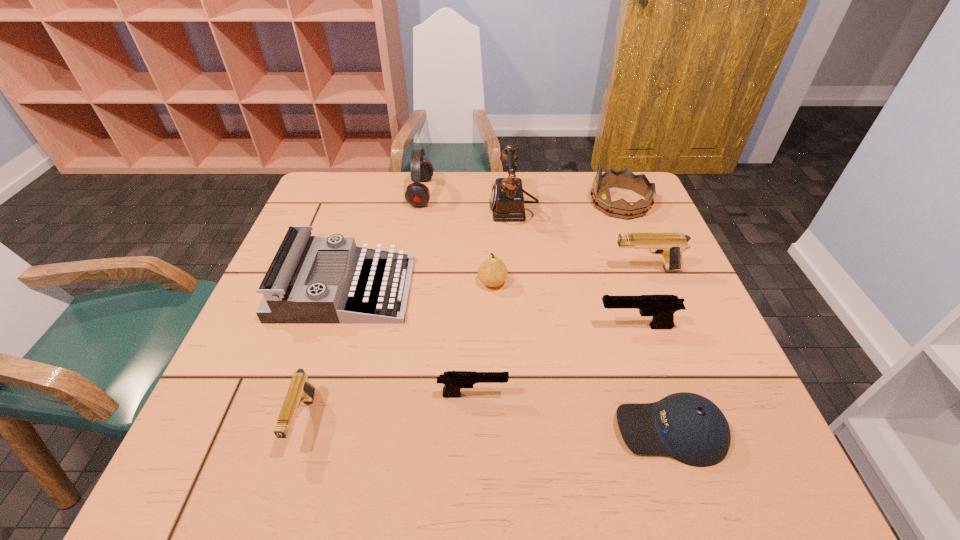
You are a GUI agent. You are given a task and a screenshot of the screen. Output one action in this format:
    pyautogui.click(x=<x>, y=<y>)
    Task: Click on the vacant point located at the front of the tiara with jewels
    The image size is (960, 540).
    Given the screenshot: What is the action you would take?
    pyautogui.click(x=557, y=202)

Locate an element on the screen. This screenshot has width=960, height=540. vacant space situated 0.230m at the barrel of the farthest pistol is located at coordinates (520, 269).

Find the location of a particular element. This screenshot has height=540, width=960. free space located 0.090m at the barrel of the farthest pistol is located at coordinates (575, 269).

The width and height of the screenshot is (960, 540). Find the location of `vacant space located at the barrel of the farthest pistol`. vacant space located at the barrel of the farthest pistol is located at coordinates (469, 269).

You are a GUI agent. You are given a task and a screenshot of the screen. Output one action in this format:
    pyautogui.click(x=<x>, y=<y>)
    Task: Click on the vacant space situated on the typing side of the black typewriter
    
    Given the screenshot: What is the action you would take?
    pyautogui.click(x=541, y=289)

Identify the location of vacant area situated 0.110m on the front-facing side of the right black pistol. Image resolution: width=960 pixels, height=540 pixels. (547, 326).

The height and width of the screenshot is (540, 960). I want to click on vacant space situated on the front-facing side of the right black pistol, so click(529, 326).

Identify the location of free space located 0.170m on the front-facing side of the right black pistol. click(520, 326).

At what (x,y) coordinates should I click in order to perform the action: click on free space located 0.310m on the back of the pear. Please return your answer as a coordinate pair (x, y). This screenshot has width=960, height=540. Looking at the image, I should click on (491, 202).

You are a GUI agent. You are given a task and a screenshot of the screen. Output one action in this format:
    pyautogui.click(x=<x>, y=<y>)
    Task: Click on the free space located on the front-facing side of the nearer black pistol
    
    Given the screenshot: What is the action you would take?
    tap(706, 395)